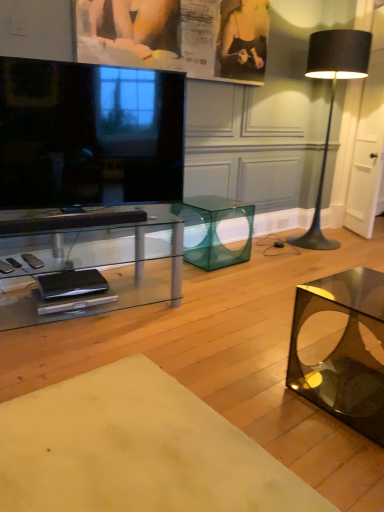
Where is `free spot to the right of clear glass table at center, the second table positioned from the front`? free spot to the right of clear glass table at center, the second table positioned from the front is located at coordinates (209, 323).